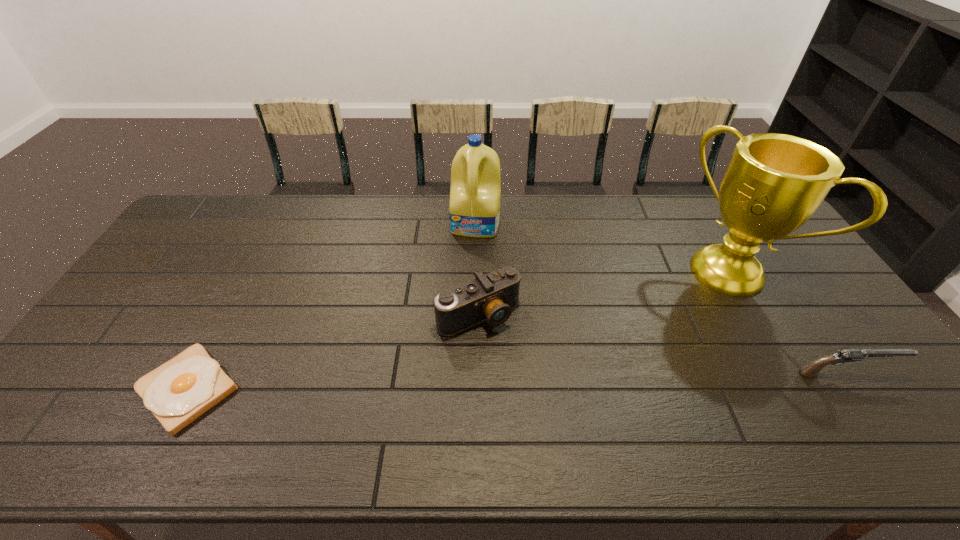
This screenshot has height=540, width=960. I want to click on empty location between the second shortest object and the tallest object, so click(x=787, y=323).

The height and width of the screenshot is (540, 960). I want to click on unoccupied position between the third tallest object and the fourth tallest object, so click(x=662, y=343).

Locate an element on the screen. vacant space that is in between the award and the fourth tallest object is located at coordinates (787, 323).

I want to click on vacant point located between the camera and the tallest object, so click(x=604, y=293).

Identify the location of free space between the gun and the award. (787, 323).

Point out which object is positioned as the nearest to the toast. Please provide its 2D coordinates. Your answer should be formatted as a tuple, i.e. [(x, y)], where the tuple contains the x and y coordinates of a point satisfying the conditions above.

[(491, 297)]

The height and width of the screenshot is (540, 960). Identify the location of object that is the third closest one to the third shortest object. (774, 183).